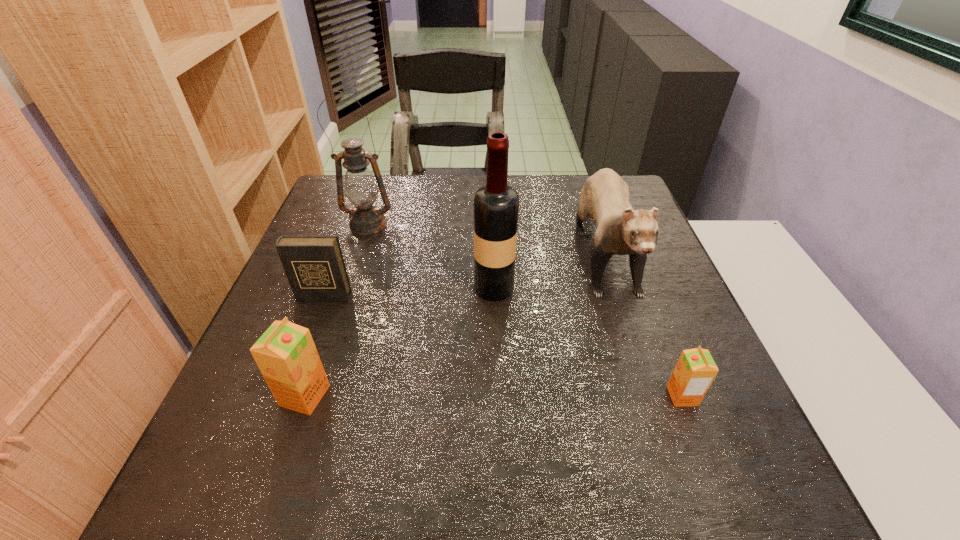
The width and height of the screenshot is (960, 540). I want to click on the taller orange juice, so click(286, 355).

Locate an element on the screen. This screenshot has height=540, width=960. the shortest object is located at coordinates (695, 370).

Identify the location of the shorter orange juice. (695, 370).

I want to click on wine bottle, so [496, 206].

Where is `the fourth shortest object`? The height and width of the screenshot is (540, 960). the fourth shortest object is located at coordinates (620, 230).

Find the location of a particular element. Image resolution: width=960 pixels, height=540 pixels. diary is located at coordinates (314, 265).

At what (x,y) coordinates should I click in order to perform the action: click on oil lamp. Please return your answer as a coordinate pair (x, y). Looking at the image, I should click on (361, 189).

Where is `vacant space located 0.130m on the right of the taller orange juice`? This screenshot has height=540, width=960. vacant space located 0.130m on the right of the taller orange juice is located at coordinates (399, 396).

The width and height of the screenshot is (960, 540). Identify the location of vacant region located 0.240m on the left of the shorter orange juice. (537, 396).

At what (x,y) coordinates should I click in order to perform the action: click on vacant region located on the right of the wine bottle. Please return your answer as a coordinate pair (x, y). Looking at the image, I should click on (575, 288).